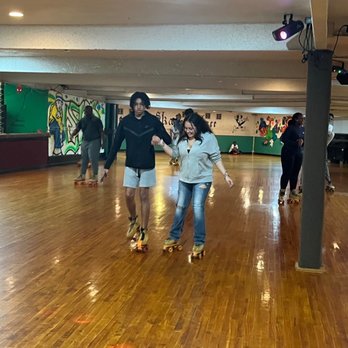
Where is `murals`? This screenshot has width=348, height=348. murals is located at coordinates (64, 117), (272, 129).